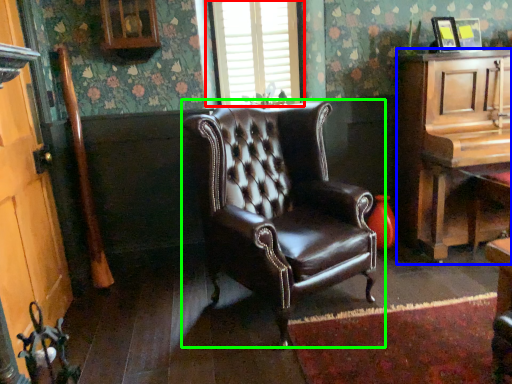
Question: Which object is the closest to the window (highlighted by a red box)? Choose among these: cabinetry (highlighted by a blue box) or chair (highlighted by a green box).

Choices:
 (A) cabinetry
 (B) chair

Answer: (B)